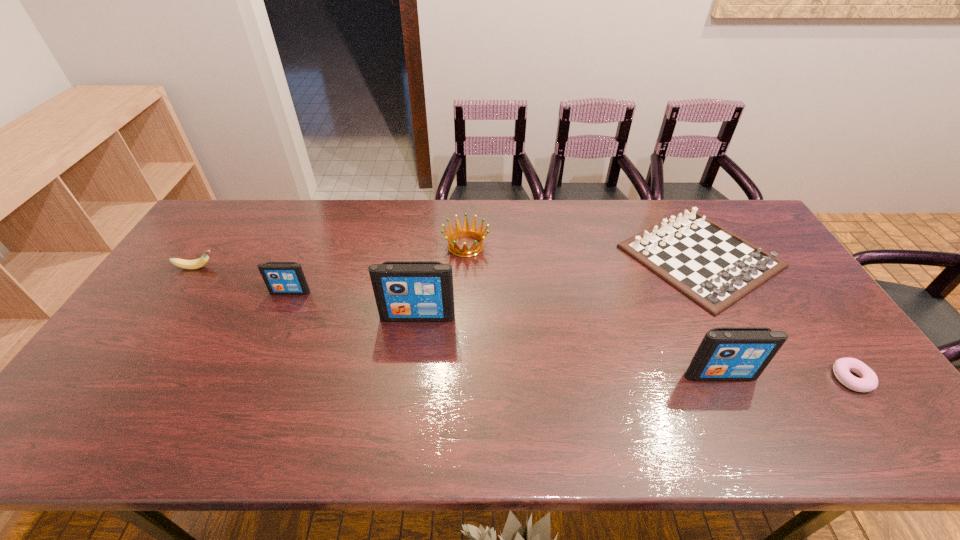
To achieve even spacing by inserting another iPod among them, please point to a vacant spot for this new iPod. Please provide its 2D coordinates. Your answer should be formatted as a tuple, i.e. [(x, y)], where the tuple contains the x and y coordinates of a point satisfying the conditions above.

[(560, 344)]